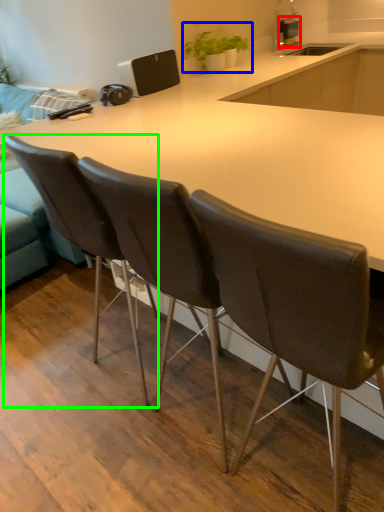
Question: Which object is positioned closest to kitchen appliance (highlighted by a red box)? Select from houseplant (highlighted by a blue box) and chair (highlighted by a green box).

Choices:
 (A) houseplant
 (B) chair

Answer: (A)